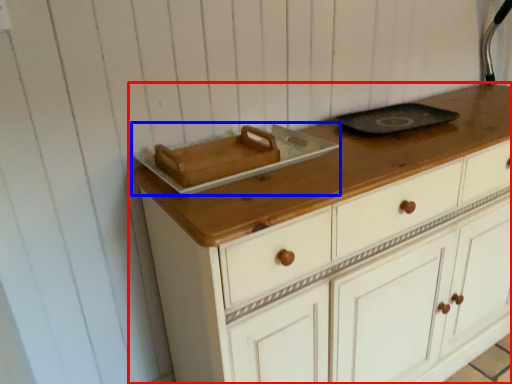
Question: Which object appears closest to the camera in this image, chest of drawers (highlighted by a red box) or appliance (highlighted by a blue box)?

Choices:
 (A) chest of drawers
 (B) appliance

Answer: (A)